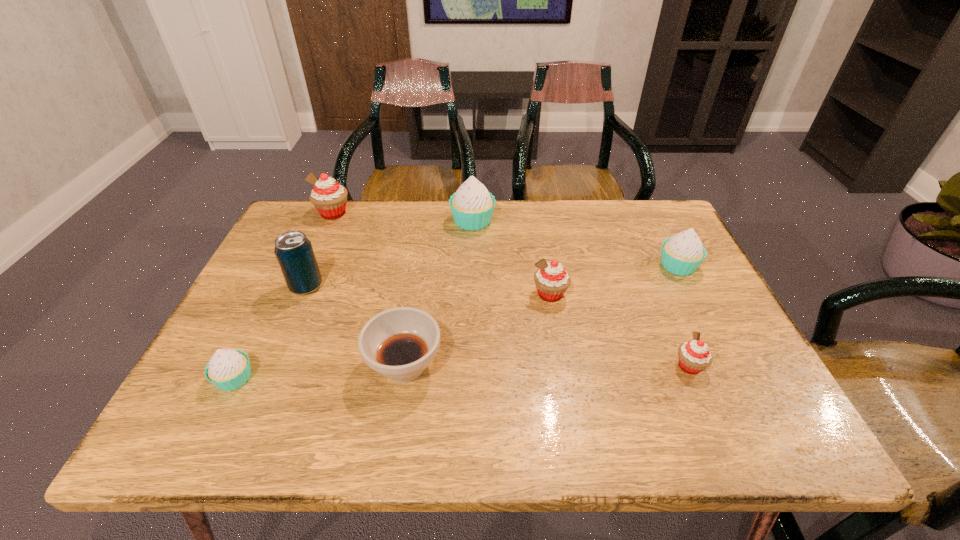
In the image, there is a desktop. At what (x,y) coordinates should I click in order to perform the action: click on vacant area at the far right corner. Please return your answer as a coordinate pair (x, y). The height and width of the screenshot is (540, 960). Looking at the image, I should click on (648, 245).

The height and width of the screenshot is (540, 960). Identify the location of vacant space that is in between the rightmost pink cupcake and the rightmost white cupcake. (684, 316).

Where is `vacant space in between the second smallest white cupcake and the leftmost pink cupcake`? Image resolution: width=960 pixels, height=540 pixels. vacant space in between the second smallest white cupcake and the leftmost pink cupcake is located at coordinates (506, 239).

Locate an element on the screen. vacant area that lies between the soup bowl and the third cupcake from left to right is located at coordinates (439, 293).

Locate an element on the screen. Image resolution: width=960 pixels, height=540 pixels. free space between the rightmost pink cupcake and the rightmost white cupcake is located at coordinates 684,316.

The width and height of the screenshot is (960, 540). Identify the location of free space that is in between the soup bowl and the smallest pink cupcake. (547, 366).

Where is `free space between the biggest pink cupcake and the rightmost white cupcake`? This screenshot has height=540, width=960. free space between the biggest pink cupcake and the rightmost white cupcake is located at coordinates (506, 239).

The image size is (960, 540). Identify the location of unoccupied area between the biggest pink cupcake and the soup bowl. (369, 289).

Image resolution: width=960 pixels, height=540 pixels. Identify the location of vacant space in between the soup bowl and the third farthest cupcake. (541, 315).

The width and height of the screenshot is (960, 540). I want to click on blank region between the nearest pink cupcake and the soup bowl, so click(x=547, y=366).